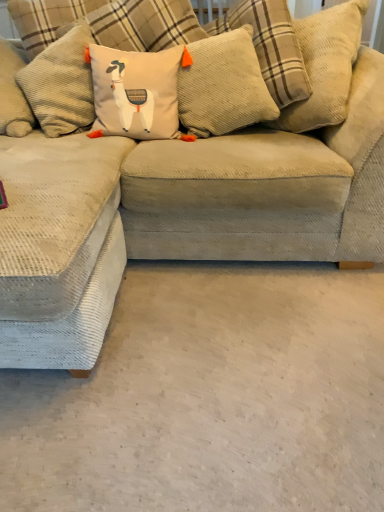
Question: In terms of width, does beige corduroy couch at center look wider or thinner when compared to corduroy pillow at center, placed as the second pillow when sorted from left to right?

Choices:
 (A) thin
 (B) wide

Answer: (B)

Question: From the image's perspective, is beige corduroy couch at center above or below corduroy pillow at center, placed as the second pillow when sorted from left to right?

Choices:
 (A) below
 (B) above

Answer: (A)

Question: Based on their relative distances, which object is farther from the corduroy pillow at center, the 2th pillow from the right?

Choices:
 (A) beige corduroy couch at center
 (B) beige corduroy pillow with llama design at center, the first pillow when ordered from left to right
 (C) white carpet at lower left
 (D) corduroy pillow at center, arranged as the third pillow when viewed from the left

Answer: (C)

Question: Based on their relative distances, which object is nearer to the beige corduroy pillow with llama design at center, the first pillow when ordered from left to right?

Choices:
 (A) corduroy pillow at center, placed as the second pillow when sorted from left to right
 (B) beige corduroy couch at center
 (C) corduroy pillow at center, arranged as the third pillow when viewed from the left
 (D) white carpet at lower left

Answer: (A)